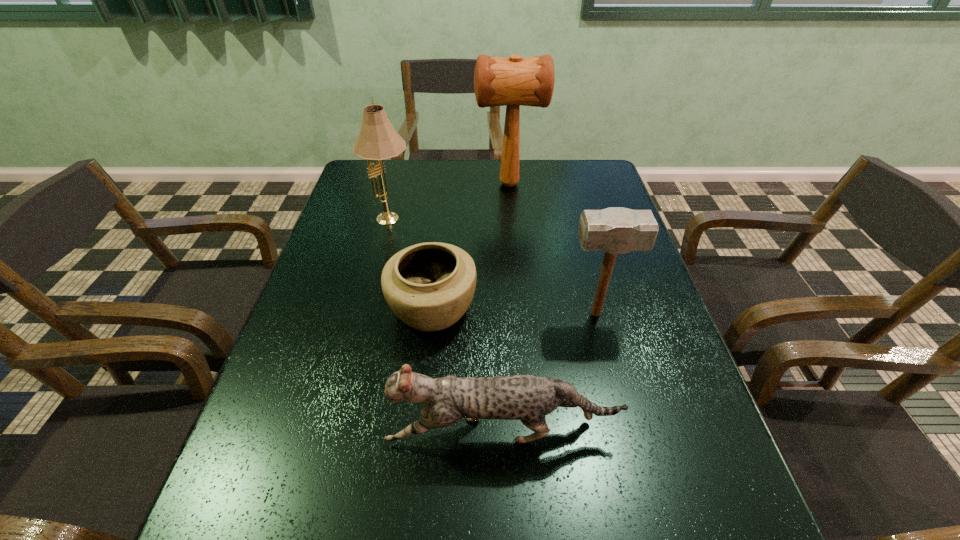
This screenshot has height=540, width=960. I want to click on object located at the left edge, so click(378, 140).

Where is `object that is at the right edge`? object that is at the right edge is located at coordinates (615, 230).

Where is `vacant area at the far edge`? The image size is (960, 540). vacant area at the far edge is located at coordinates (448, 194).

Locate an element on the screen. vacant space at the left edge of the desktop is located at coordinates (323, 391).

In the image, there is a desktop. Where is `vacant space at the right edge`? vacant space at the right edge is located at coordinates (642, 266).

Identify the location of free spot at the far left corner of the desktop. The image size is (960, 540). (344, 192).

The image size is (960, 540). Identify the location of free region at the near left corner of the desktop. (291, 537).

Find the location of a particular element. The height and width of the screenshot is (540, 960). vacant space that is in between the third shortest object and the farthest object is located at coordinates (552, 249).

Where is `vacant area that lies between the taller mallet and the pottery`? This screenshot has height=540, width=960. vacant area that lies between the taller mallet and the pottery is located at coordinates (470, 247).

This screenshot has width=960, height=540. I want to click on vacant space that's between the shortest object and the third tallest object, so point(514,312).